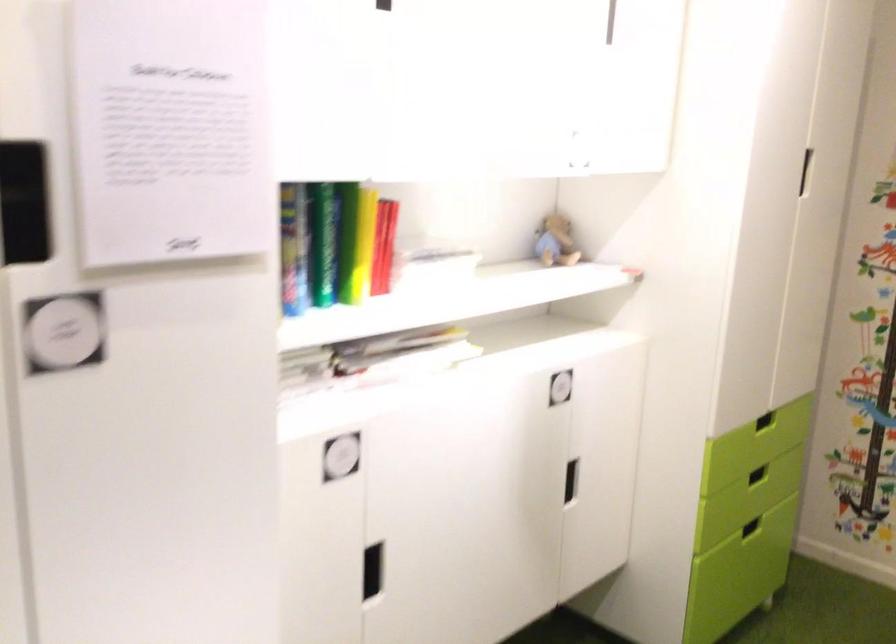
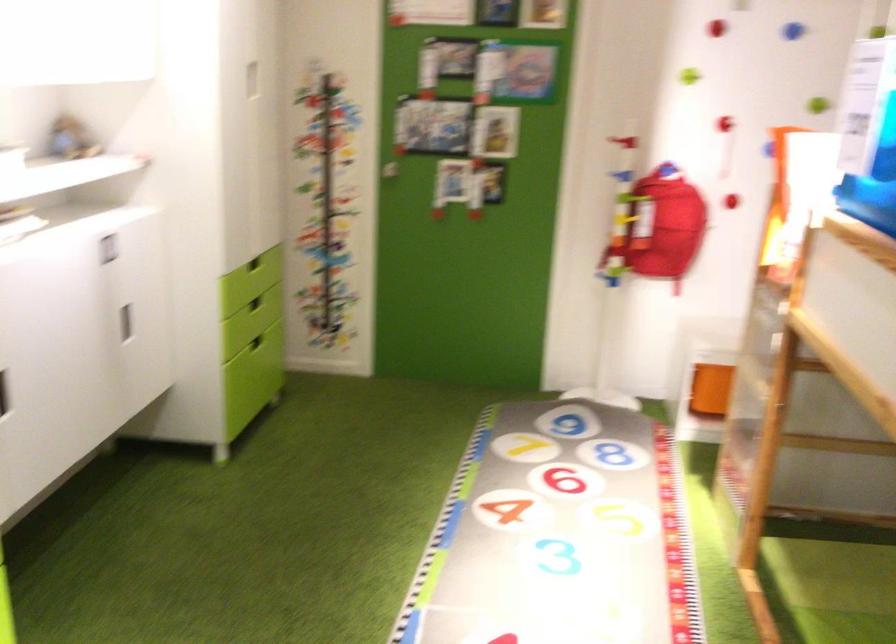
The point at (x=764, y=420) is marked in the first image. Where is the corresponding point in the second image?

(254, 263)